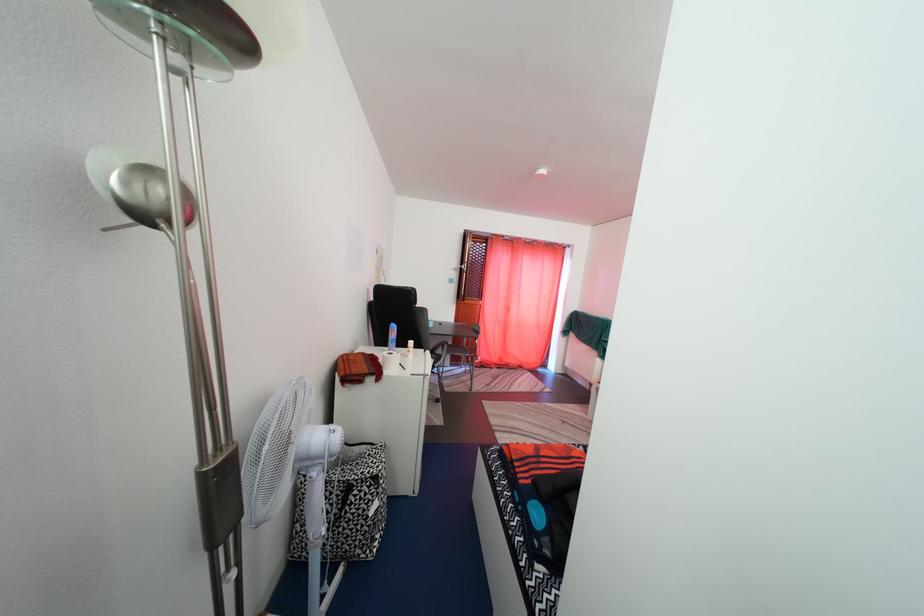
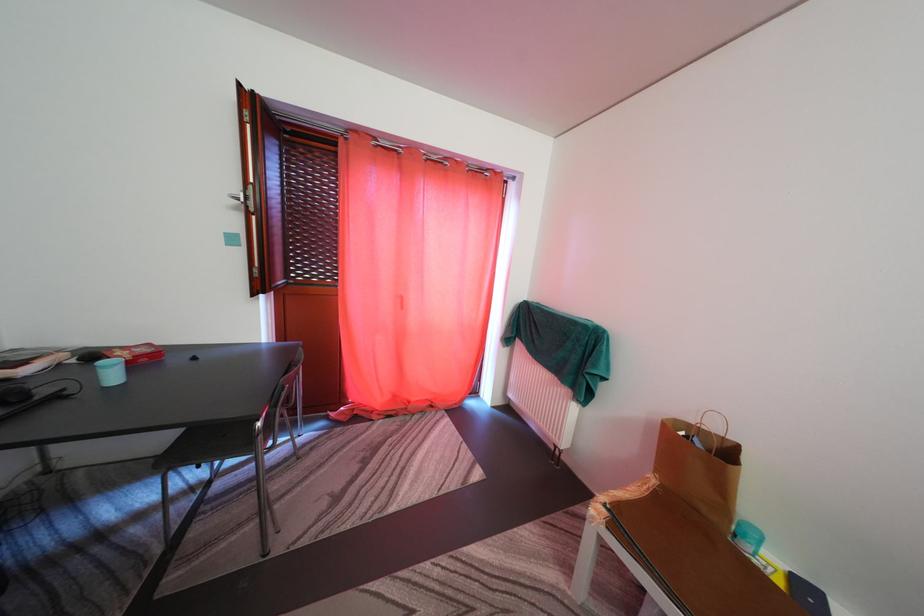
The images are taken continuously from a first-person perspective. In which direction are you moving?

The movement direction of the cameraman is right, forward.